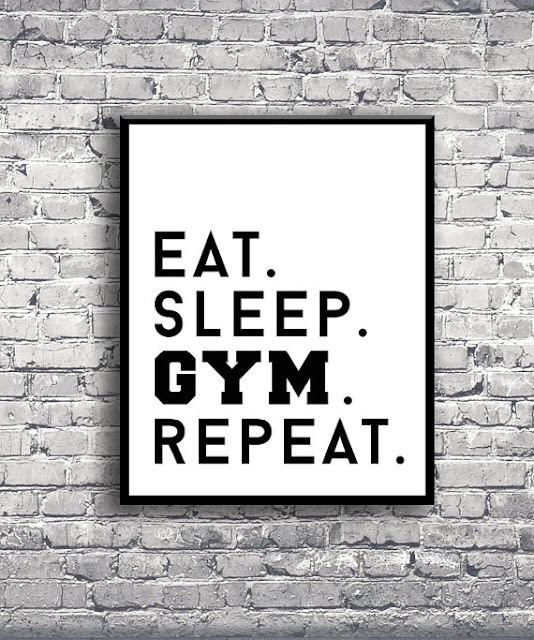
Identify the location of wall. (266, 537).